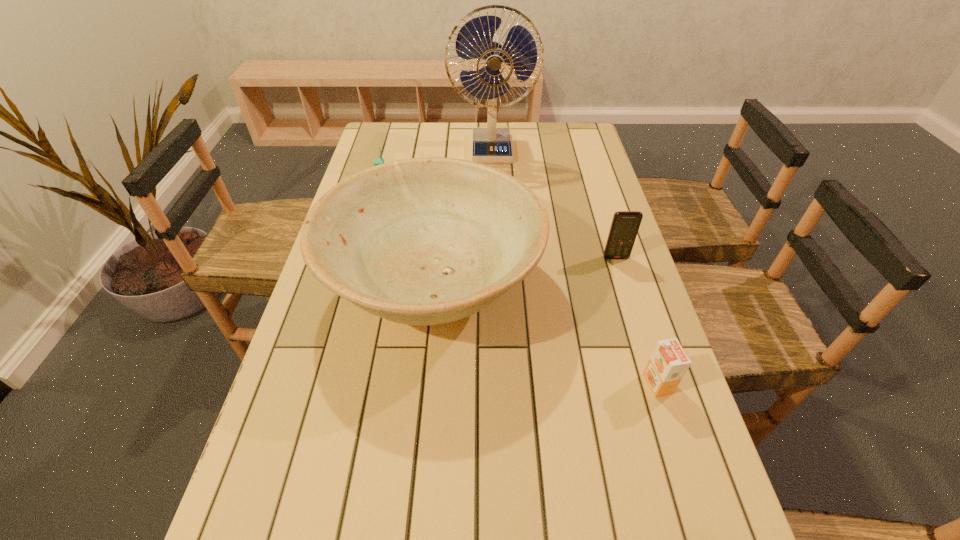
The image size is (960, 540). Identify the location of vacant region at the far right corner of the desktop. (577, 152).

Where is `vacant space in between the orange juice and the right cellular telephone`? vacant space in between the orange juice and the right cellular telephone is located at coordinates (636, 321).

Find the location of a particular element. The width and height of the screenshot is (960, 540). free spot between the dish and the orange juice is located at coordinates (546, 335).

Where is `free space between the orange juice and the fan`? This screenshot has height=540, width=960. free space between the orange juice and the fan is located at coordinates (575, 267).

Find the location of a particular element. The width and height of the screenshot is (960, 540). empty space between the orange juice and the left cellular telephone is located at coordinates (520, 285).

Image resolution: width=960 pixels, height=540 pixels. In order to click on the third closest object to the nearer cellular telephone in this screenshot , I will do `click(477, 38)`.

Locate an element on the screen. The image size is (960, 540). object that is the fourth closest to the fan is located at coordinates 668,363.

Identify the location of free spot that satisfies the following two spatial constraints: 1. on the screen of the orange juice; 2. on the left side of the right cellular telephone. (655, 383).

Locate an element on the screen. The image size is (960, 540). vacant area that satisfies the following two spatial constraints: 1. on the keypad of the dish; 2. on the left side of the shorter cellular telephone is located at coordinates (356, 286).

Find the location of `vacant region that satisfies the following two spatial constraints: 1. on the front-facing side of the orange juice; 2. on the left side of the fan`. vacant region that satisfies the following two spatial constraints: 1. on the front-facing side of the orange juice; 2. on the left side of the fan is located at coordinates (500, 383).